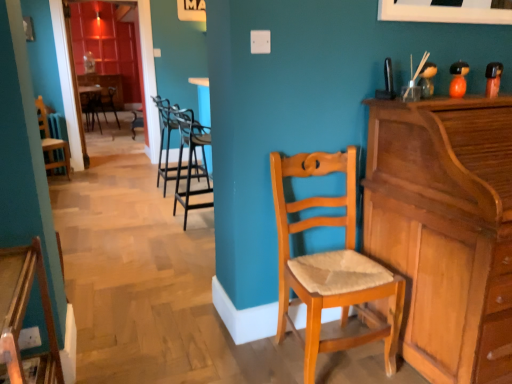
Question: From a real-world perspective, is wooden chair with cushion at center, positioned as the 6th chair in right-to-left order, physically above black metal barstools at center, the 5th chair from the left?

Choices:
 (A) no
 (B) yes

Answer: (B)

Question: Considering the relative positions of wooden chair with cushion at center, which ranks as the 1th chair in left-to-right order, and black metal barstools at center, the 5th chair from the left, in the image provided, is wooden chair with cushion at center, which ranks as the 1th chair in left-to-right order, in front of black metal barstools at center, the 5th chair from the left,?

Choices:
 (A) no
 (B) yes

Answer: (A)

Question: Is wooden chair with cushion at center, positioned as the 6th chair in right-to-left order, facing towards black metal barstools at center, which appears as the fourth chair when viewed from the back?

Choices:
 (A) no
 (B) yes

Answer: (B)

Question: Is wooden chair with cushion at center, positioned as the 6th chair in right-to-left order, completely or partially outside of black metal barstools at center, marked as the third chair in a front-to-back arrangement?

Choices:
 (A) yes
 (B) no

Answer: (A)

Question: From a real-world perspective, is wooden chair with cushion at center, which is counted as the 1th chair, starting from the back, under black metal barstools at center, marked as the 2th chair in a right-to-left arrangement?

Choices:
 (A) yes
 (B) no

Answer: (B)

Question: Does wooden chair with cushion at center, positioned as the 6th chair in right-to-left order, have a smaller size compared to black metal barstools at center, the 5th chair from the left?

Choices:
 (A) no
 (B) yes

Answer: (A)

Question: Does black metal barstools at center, marked as the 2th chair in a right-to-left arrangement, have a greater height compared to light brown wood piano at right?

Choices:
 (A) yes
 (B) no

Answer: (B)

Question: Is black metal barstools at center, which appears as the fourth chair when viewed from the back, at the right side of light brown wood piano at right?

Choices:
 (A) no
 (B) yes

Answer: (A)

Question: From the image's perspective, is black metal barstools at center, marked as the 2th chair in a right-to-left arrangement, beneath light brown wood piano at right?

Choices:
 (A) yes
 (B) no

Answer: (B)

Question: Is light brown wood piano at right at the back of black metal barstools at center, marked as the 2th chair in a right-to-left arrangement?

Choices:
 (A) no
 (B) yes

Answer: (A)

Question: Is light brown wood piano at right surrounded by black metal barstools at center, the 5th chair from the left?

Choices:
 (A) no
 (B) yes

Answer: (A)

Question: Is black metal barstools at center, marked as the 2th chair in a right-to-left arrangement, oriented towards light brown wood piano at right?

Choices:
 (A) no
 (B) yes

Answer: (A)

Question: Can you confirm if light brown wooden chair at center, the first chair positioned from the right, is positioned to the left of light brown wood piano at right?

Choices:
 (A) no
 (B) yes

Answer: (B)